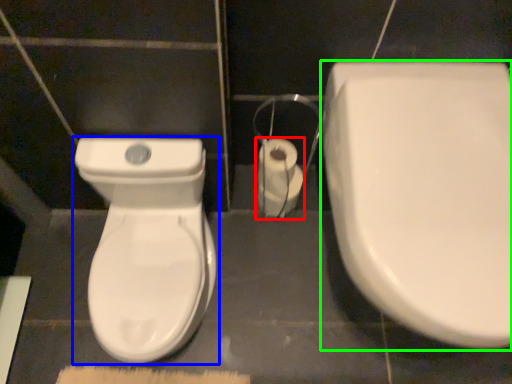
Question: Which is nearer to the toilet paper (highlighted by a red box)? toilet (highlighted by a blue box) or toilet (highlighted by a green box).

Choices:
 (A) toilet
 (B) toilet

Answer: (A)